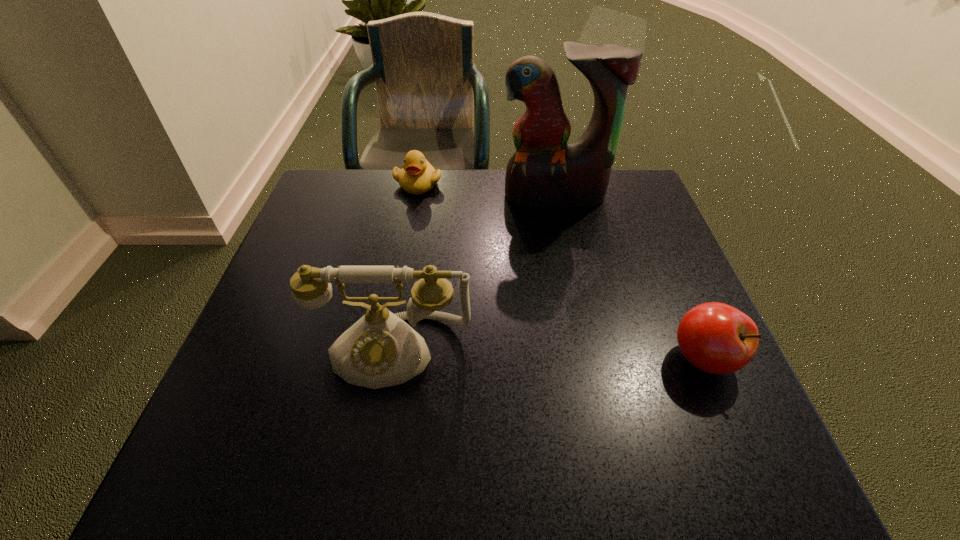
Find the location of a particular element. Image resolution: width=960 pixels, height=540 pixels. vacant region located 0.100m on the front-facing side of the duckling is located at coordinates (438, 216).

You are a GUI agent. You are given a task and a screenshot of the screen. Output one action in this format:
    pyautogui.click(x=<x>, y=<y>)
    Task: Click on the free region located 0.400m on the front-facing side of the duckling
    The image size is (960, 540).
    Given the screenshot: What is the action you would take?
    pyautogui.click(x=484, y=294)

The image size is (960, 540). Find the location of `free region located 0.200m on the front-facing side of the duckling`. free region located 0.200m on the front-facing side of the duckling is located at coordinates (451, 239).

Find the location of a particular element. parrot that is at the far edge is located at coordinates (544, 172).

This screenshot has height=540, width=960. In order to click on duckling that is at the far edge in this screenshot , I will do `click(418, 176)`.

Locate an element on the screen. The width and height of the screenshot is (960, 540). telephone that is at the near edge is located at coordinates (380, 350).

The image size is (960, 540). In order to click on apple that is at the near edge in this screenshot , I will do pyautogui.click(x=716, y=338).

Where is `object that is at the left edge`? object that is at the left edge is located at coordinates (380, 350).

This screenshot has width=960, height=540. Identify the location of apple present at the right edge. (716, 338).

This screenshot has height=540, width=960. Find the location of `parrot that is at the right edge`. parrot that is at the right edge is located at coordinates (544, 172).